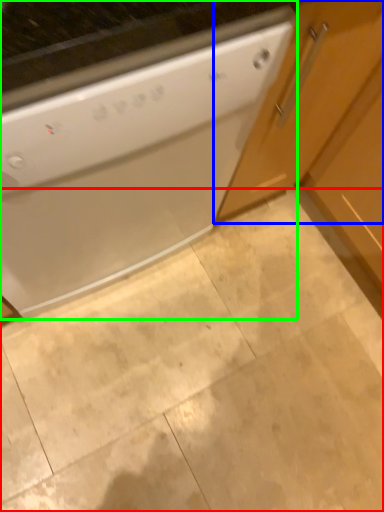
Question: Based on their relative distances, which object is farther from granite (highlighted by a red box)? Choose from cabinetry (highlighted by a blue box) and home appliance (highlighted by a green box).

Choices:
 (A) cabinetry
 (B) home appliance

Answer: (A)